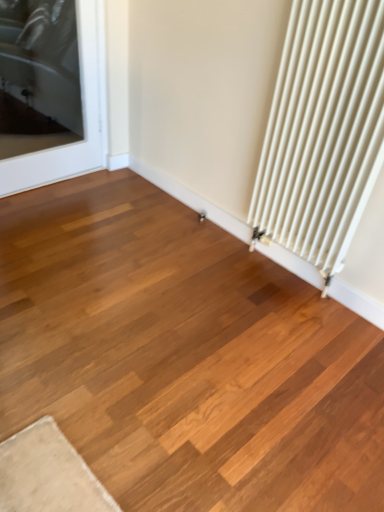
At what (x,y) coordinates should I click in order to perform the action: click on free space in front of transparent glass door at upper left. Please return your answer as a coordinate pair (x, y). Looking at the image, I should click on (59, 220).